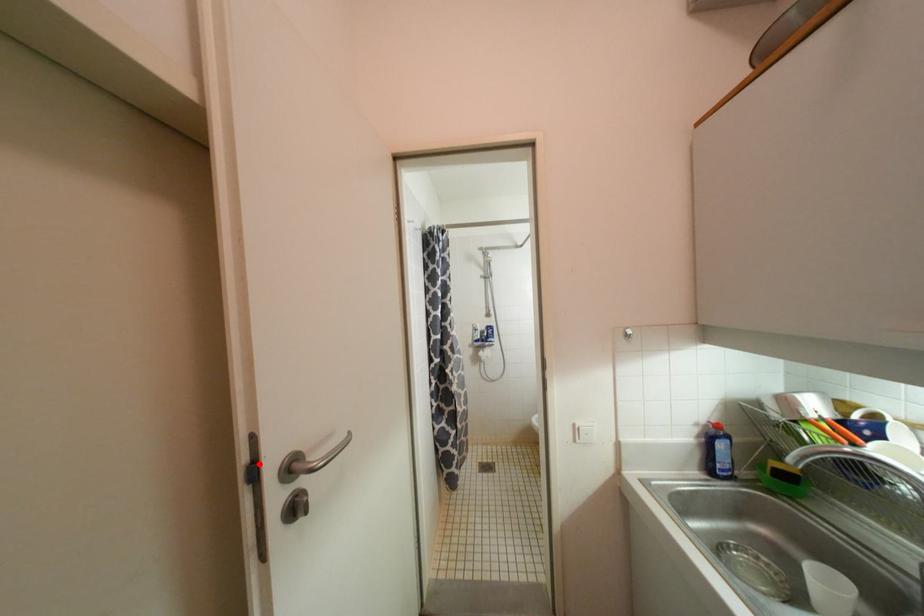
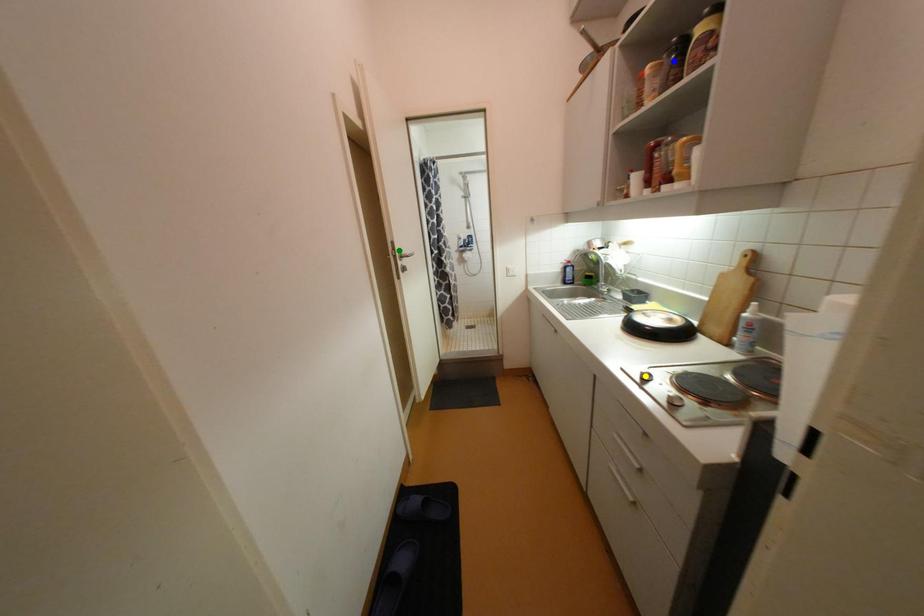
Question: I am providing you with two images of the same scene from different viewpoints. A red point is marked on the first image. You are given multiple points on the second image. Which spot in image 2 lines up with the point in image 1?

Choices:
 (A) yellow point
 (B) blue point
 (C) green point

Answer: (C)